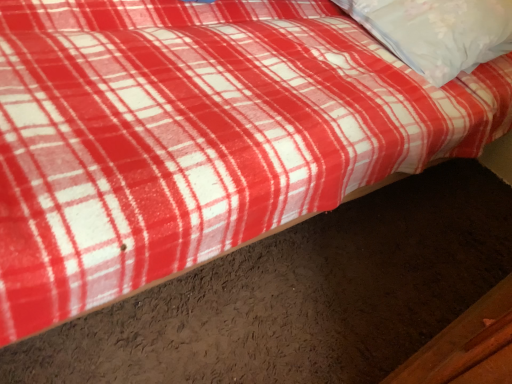
The image size is (512, 384). What do you see at coordinates (437, 32) in the screenshot? I see `white floral fabric pillow at upper right` at bounding box center [437, 32].

The image size is (512, 384). Identify the location of white floral fabric pillow at upper right. (437, 32).

Measure the distance between point (467, 47) and camera.

They are 3.98 feet apart.

The height and width of the screenshot is (384, 512). In order to click on white floral fabric pillow at upper right in this screenshot , I will do `click(437, 32)`.